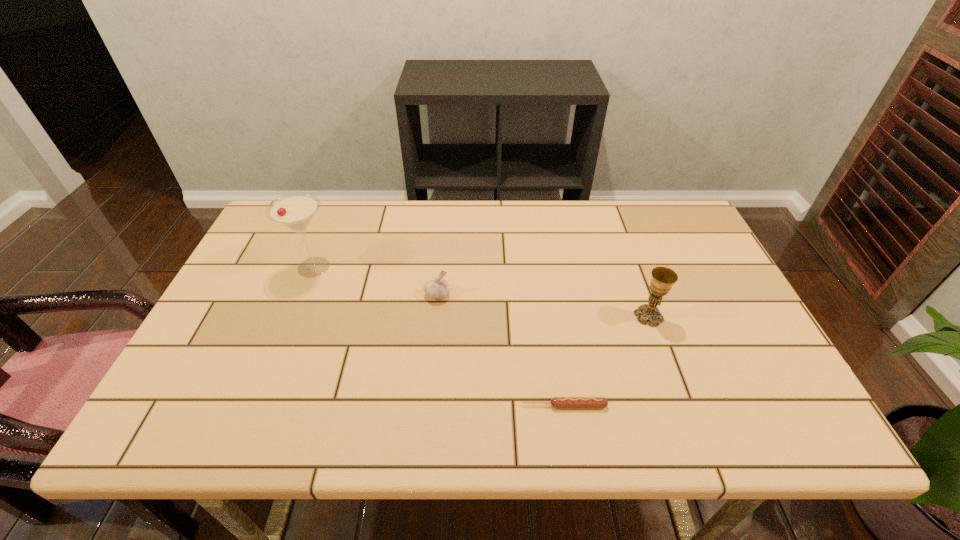
Identify the location of vacant area situated 0.210m on the right of the third nearest object. click(529, 294).

This screenshot has width=960, height=540. I want to click on free space located 0.240m on the back of the sausage, so [551, 316].

You are a GUI agent. You are given a task and a screenshot of the screen. Output one action in this format:
    pyautogui.click(x=<x>, y=<y>)
    Task: Click on the object present at the near edge
    This screenshot has width=960, height=540.
    Given the screenshot: What is the action you would take?
    pyautogui.click(x=556, y=402)

Locate an element on the screen. object that is positioned at the left edge is located at coordinates (295, 211).

The image size is (960, 540). What are the coordinates of `free region at the far edge` in the screenshot? It's located at (480, 210).

Where is `free location at the near edge of the desktop`? Image resolution: width=960 pixels, height=540 pixels. free location at the near edge of the desktop is located at coordinates (671, 408).

I want to click on free space at the left edge of the desktop, so click(214, 341).

Where is `vacant space at the right edge of the desktop`? The image size is (960, 540). vacant space at the right edge of the desktop is located at coordinates (730, 294).

Where is `vacant space at the far right corner of the desktop`? Image resolution: width=960 pixels, height=540 pixels. vacant space at the far right corner of the desktop is located at coordinates (678, 201).

You are a GUI agent. You are given a task and a screenshot of the screen. Output one action in this format:
    pyautogui.click(x=<x>, y=<y>)
    Task: Click on the vacant region between the nearest object and the garlic
    The width and height of the screenshot is (960, 540).
    Given the screenshot: What is the action you would take?
    pyautogui.click(x=501, y=350)